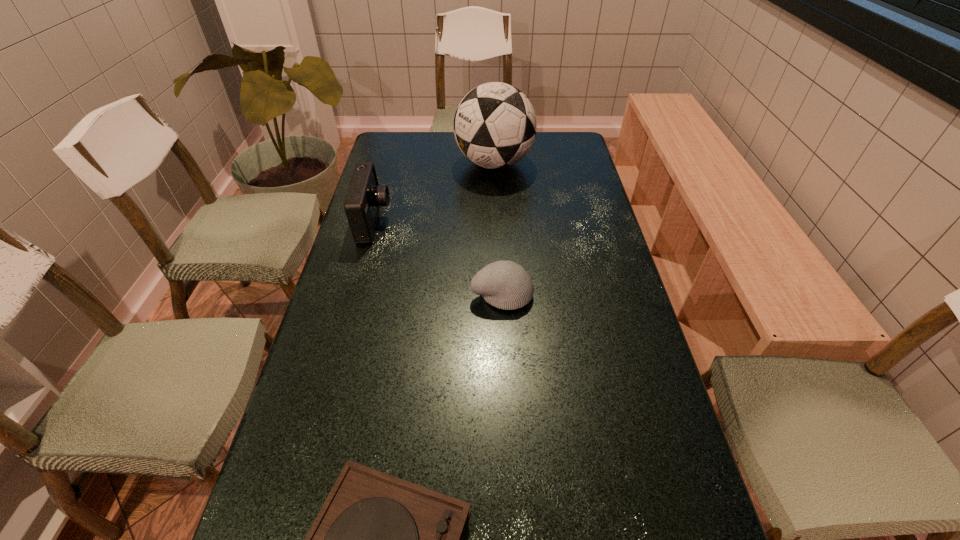
Locate an element on the screen. empty space between the second shortest object and the camera is located at coordinates [x=438, y=258].

Identify the location of empty space between the soccer ball and the second shortest object. Image resolution: width=960 pixels, height=540 pixels. (498, 229).

Locate an element on the screen. The height and width of the screenshot is (540, 960). object that stands as the third closest to the third farthest object is located at coordinates (495, 125).

Choose which object is the third nearest neighbor to the third farthest object. Please provide its 2D coordinates. Your answer should be formatted as a tuple, i.e. [(x, y)], where the tuple contains the x and y coordinates of a point satisfying the conditions above.

[(495, 125)]

Where is `free space that satisfies the following two spatial constraints: 1. on the surface of the soccer ball where the brand logo is visible; 2. on the left side of the second shortest object`? free space that satisfies the following two spatial constraints: 1. on the surface of the soccer ball where the brand logo is visible; 2. on the left side of the second shortest object is located at coordinates tap(500, 294).

In order to click on free space that satisfies the following two spatial constraints: 1. on the surface of the farthest object where the brand logo is visible; 2. on the back side of the beanie in this screenshot , I will do `click(500, 294)`.

Where is `free location that satisfies the following two spatial constraints: 1. on the front-facing side of the second shortest object; 2. on the right side of the third nearest object`? This screenshot has height=540, width=960. free location that satisfies the following two spatial constraints: 1. on the front-facing side of the second shortest object; 2. on the right side of the third nearest object is located at coordinates (354, 294).

Where is `free spot that satisfies the following two spatial constraints: 1. on the back side of the third tallest object; 2. on the front-facing side of the third nearest object`? The width and height of the screenshot is (960, 540). free spot that satisfies the following two spatial constraints: 1. on the back side of the third tallest object; 2. on the front-facing side of the third nearest object is located at coordinates (498, 222).

At what (x,y) coordinates should I click in order to perform the action: click on free spot that satisfies the following two spatial constraints: 1. on the front-facing side of the second shortest object; 2. on the left side of the camera. Please return your answer as a coordinate pair (x, y). This screenshot has height=540, width=960. Looking at the image, I should click on (354, 294).

Find the location of a particular element. The image size is (960, 540). free location that satisfies the following two spatial constraints: 1. on the surface of the soccer ball where the brand logo is visible; 2. on the back side of the second shortest object is located at coordinates (500, 294).